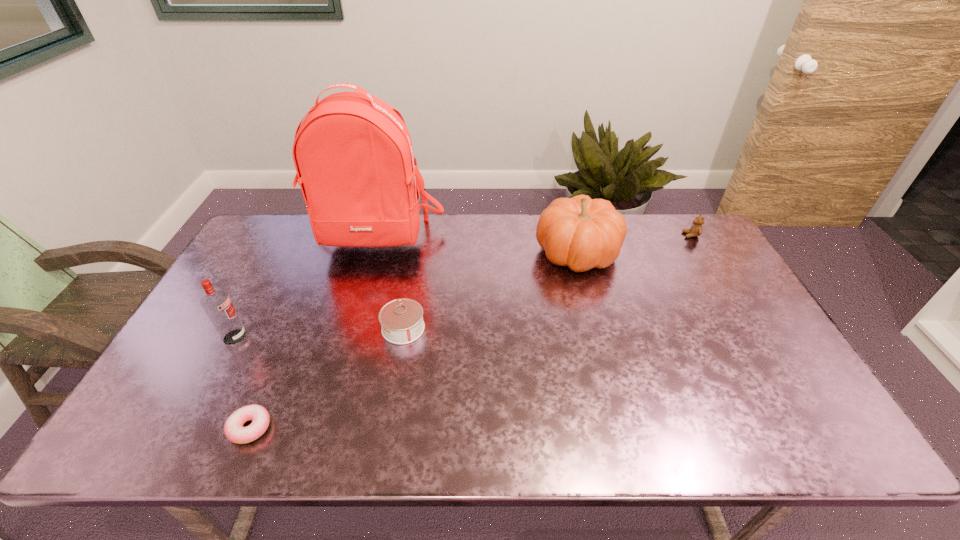
Identify the location of unoccupied area between the can and the second object from right to left. (x=491, y=291).

Identify the location of vacant region between the vodka and the second shortest object. The image size is (960, 540). coord(319,333).

Where is `vacant area that lies between the rightmost object and the backpack`? This screenshot has height=540, width=960. vacant area that lies between the rightmost object and the backpack is located at coordinates (534, 237).

You are a GUI agent. You are given a task and a screenshot of the screen. Output one action in this format:
    pyautogui.click(x=<x>, y=<y>)
    Task: Click on the vacant area that lies between the can and the tallest object
    The image size is (960, 540).
    Given the screenshot: What is the action you would take?
    [x=390, y=284]

Identify the location of empty space between the leftmost object and the teddy bear. (463, 286).

Where is `free spot between the second shortest object and the vodka`? This screenshot has height=540, width=960. free spot between the second shortest object and the vodka is located at coordinates (319, 333).

Where is `free space between the doughnut and the tallest object`? The image size is (960, 540). free space between the doughnut and the tallest object is located at coordinates (313, 334).

Identify the location of free space between the can and the vodka. This screenshot has width=960, height=540. (319, 333).

Where is `empty space between the fourth tallest object and the vodka`? The height and width of the screenshot is (540, 960). empty space between the fourth tallest object and the vodka is located at coordinates (463, 286).

Where is `vacant region between the pumpkin and the leftmost object`? This screenshot has width=960, height=540. vacant region between the pumpkin and the leftmost object is located at coordinates (406, 295).